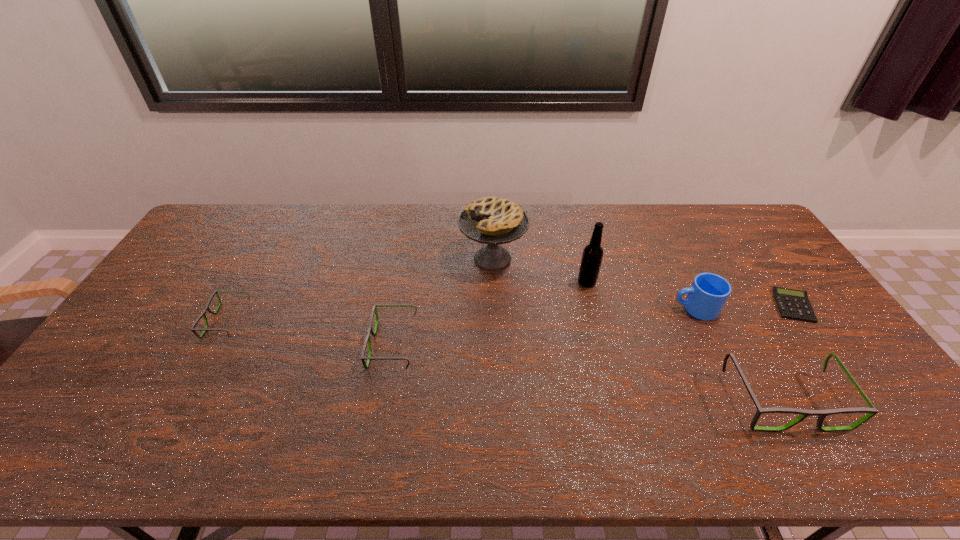
Find the location of `free region at the near edge`. free region at the near edge is located at coordinates (575, 409).

Where is `vacant space at the far left corner of the desktop`? vacant space at the far left corner of the desktop is located at coordinates (208, 226).

This screenshot has width=960, height=540. Identify the location of free space between the second object from left to right and the shortest spectacles. (310, 333).

This screenshot has width=960, height=540. In order to click on vacant area that lies between the rightmost object and the shortest spectacles in this screenshot , I will do click(x=510, y=314).

The height and width of the screenshot is (540, 960). Find the location of `free space between the fifth tallest object and the mug`. free space between the fifth tallest object and the mug is located at coordinates (544, 327).

Identify the location of vacant space that is in between the second shortest spectacles and the shortest object. The image size is (960, 540). (593, 326).

Find the location of a particular element. This screenshot has width=960, height=540. free spot between the beer bottle and the third object from left to right is located at coordinates click(540, 271).

Identify the location of empty space that is in between the mug and the tallest spectacles. (739, 354).

You are a GUI agent. You are given a task and a screenshot of the screen. Output one action in this format:
    pyautogui.click(x=<x>, y=<y>)
    Task: Click on the empty location between the mug and the second shortest spectacles
    Image resolution: width=960 pixels, height=540 pixels.
    Given the screenshot: What is the action you would take?
    pyautogui.click(x=544, y=327)

The height and width of the screenshot is (540, 960). What are the coordinates of `blank region between the fourth object from left to right and the shortest spectacles` in the screenshot? It's located at (407, 302).